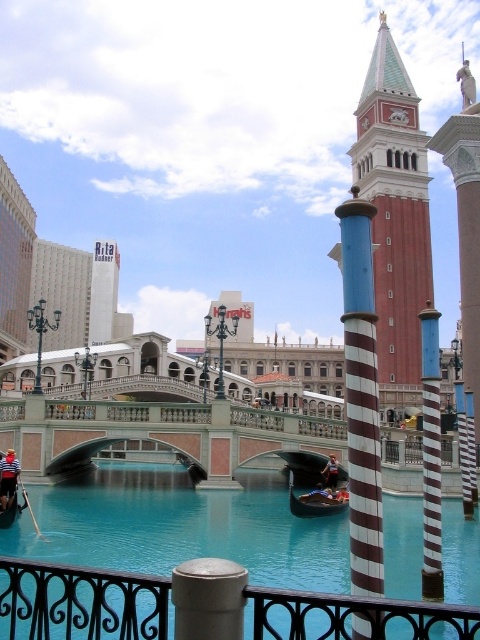
You are standing on the pedestrian bridge and want to take a photo of both the red brick tower at center and the blue and white striped pole at center. Which object should you position closer to the camera to include both in the frame?

You should position the red brick tower at center closer to the camera because the blue and white striped pole at center is behind it, so moving the tower forward will allow both to be in the frame without one blocking the other.

You are standing at the entrance of the Venetian area and want to locate the red brick tower at center. According to the coordinates given, where should you look to find it?

The red brick tower at center is located at coordinates point (x=395, y=214).